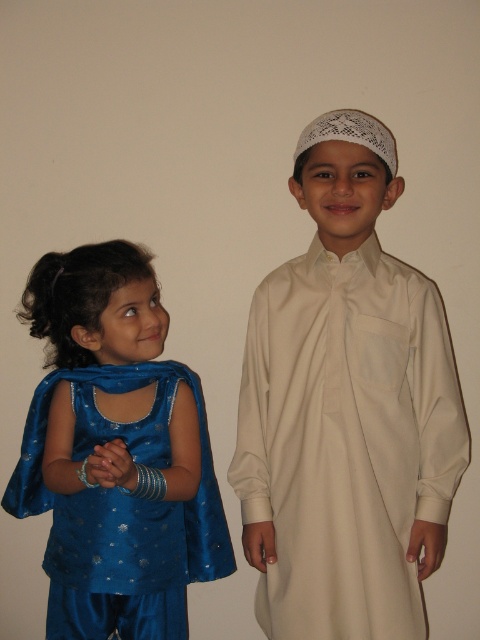
You are a GUI agent. You are given a task and a screenshot of the screen. Output one action in this format:
    pyautogui.click(x=<x>, y=<y>)
    Task: Click on the white matte kufi at center
    The width and height of the screenshot is (480, 640).
    Given the screenshot: What is the action you would take?
    pyautogui.click(x=347, y=408)

Who is more forward, (261, 406) or (92, 372)?

Point (261, 406) is more forward.

This screenshot has height=640, width=480. Identify the location of white matte kufi at center. (347, 408).